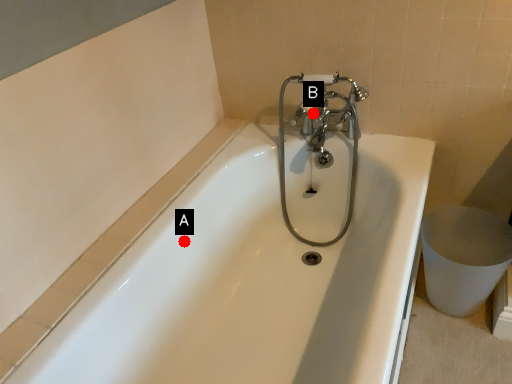
Question: Two points are circled on the image, labeled by A and B beside each circle. Which point is farther to the camera?

Choices:
 (A) A is further
 (B) B is further

Answer: (B)